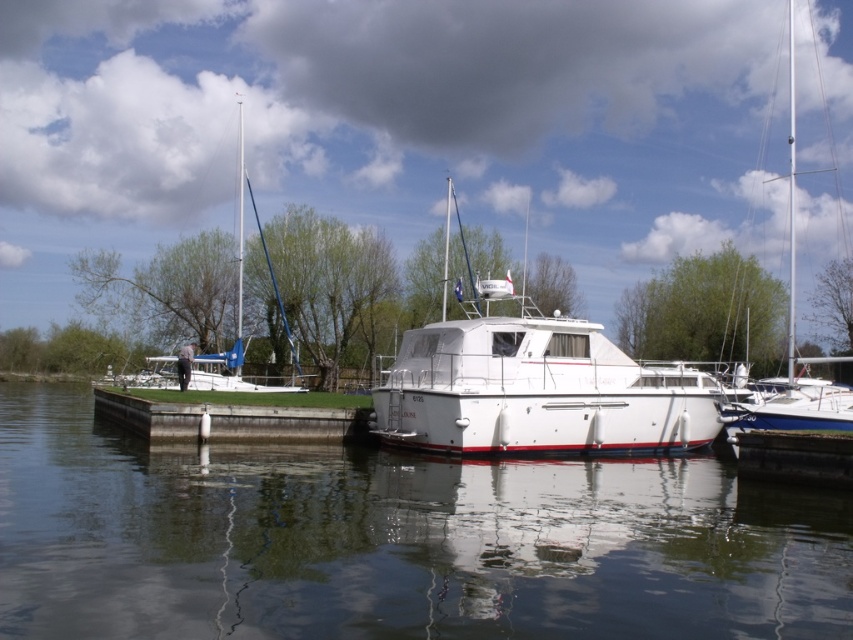
You are standing on the dock and see the transparent water at center and the white glossy sailboat at left. Which object is located to the right of the other?

The transparent water at center is positioned on the right side of white glossy sailboat at left, so the transparent water at center is to the right of the white glossy sailboat at left.